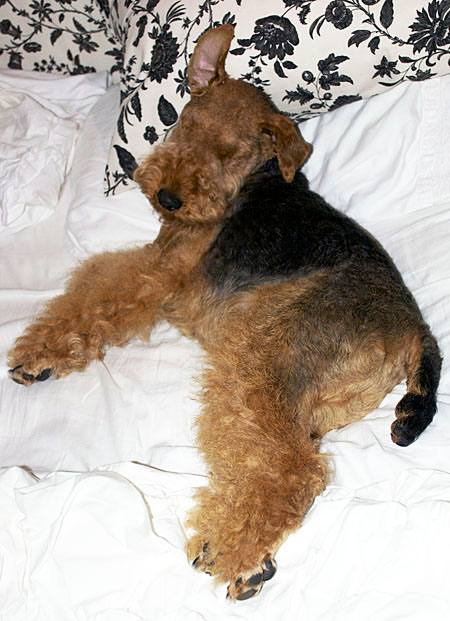
Where is `white blanket`? This screenshot has width=450, height=621. white blanket is located at coordinates (395, 179), (81, 425).